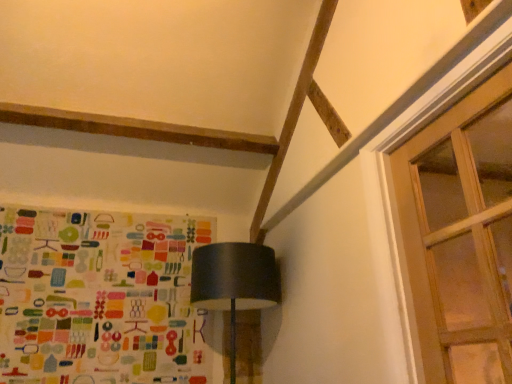
Question: From a real-world perspective, is matte black lampshade at center beneath clear glass door at upper right?

Choices:
 (A) no
 (B) yes

Answer: (B)

Question: Does matte black lampshade at center lie in front of clear glass door at upper right?

Choices:
 (A) yes
 (B) no

Answer: (B)

Question: Does matte black lampshade at center have a greater width compared to clear glass door at upper right?

Choices:
 (A) no
 (B) yes

Answer: (B)

Question: Is matte black lampshade at center thinner than clear glass door at upper right?

Choices:
 (A) yes
 (B) no

Answer: (B)

Question: Can clear glass door at upper right be found inside matte black lampshade at center?

Choices:
 (A) yes
 (B) no

Answer: (B)

Question: In terms of height, does multicolored fabric at left look taller or shorter compared to clear glass door at upper right?

Choices:
 (A) short
 (B) tall

Answer: (B)

Question: Based on their sizes in the image, would you say multicolored fabric at left is bigger or smaller than clear glass door at upper right?

Choices:
 (A) small
 (B) big

Answer: (B)

Question: Is multicolored fabric at left situated inside clear glass door at upper right or outside?

Choices:
 (A) inside
 (B) outside

Answer: (B)

Question: From a real-world perspective, relative to clear glass door at upper right, is multicolored fabric at left vertically above or below?

Choices:
 (A) below
 (B) above

Answer: (B)

Question: Do you think matte black lampshade at center is within clear glass door at upper right, or outside of it?

Choices:
 (A) outside
 (B) inside

Answer: (A)

Question: Would you say matte black lampshade at center is to the left or to the right of clear glass door at upper right in the picture?

Choices:
 (A) left
 (B) right

Answer: (A)

Question: From a real-world perspective, is matte black lampshade at center physically located above or below clear glass door at upper right?

Choices:
 (A) above
 (B) below

Answer: (B)

Question: Considering the positions of matte black lampshade at center and clear glass door at upper right in the image, is matte black lampshade at center taller or shorter than clear glass door at upper right?

Choices:
 (A) tall
 (B) short

Answer: (B)

Question: Is matte black lampshade at center taller or shorter than multicolored fabric at left?

Choices:
 (A) short
 (B) tall

Answer: (A)

Question: From the image's perspective, is matte black lampshade at center located above or below multicolored fabric at left?

Choices:
 (A) above
 (B) below

Answer: (B)